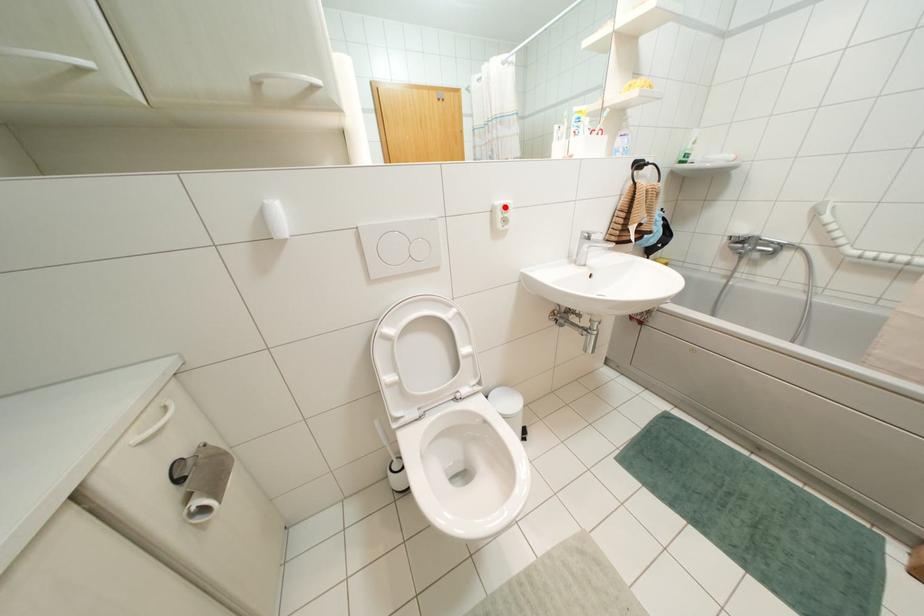
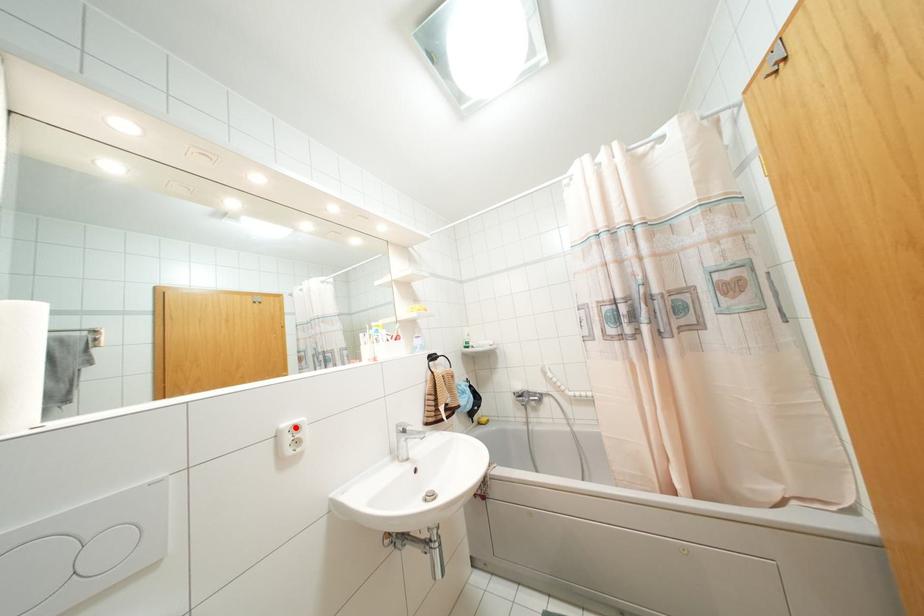
I am providing you with two images of the same scene from different viewpoints. A red point is marked on the first image and another point is marked on the second image. Do the highlighted points in image1 and image2 indicate the same real-world spot?

Yes